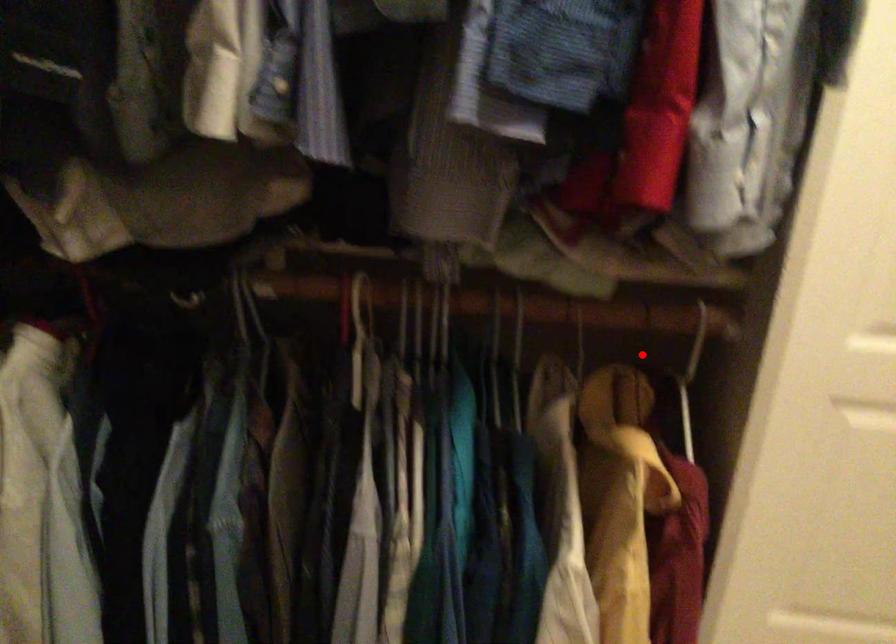
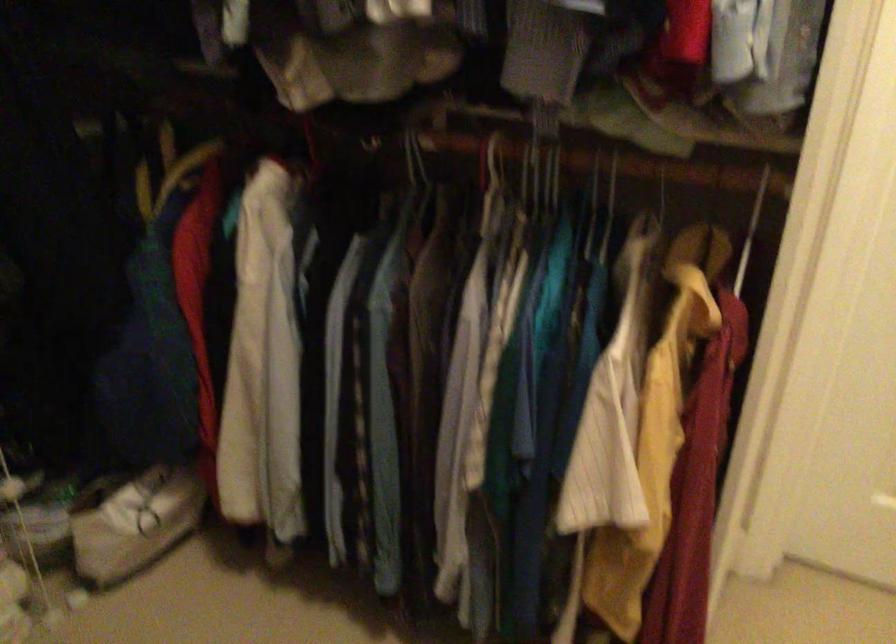
Question: I am providing you with two images of the same scene from different viewpoints. A red point is shown in image1. For the corresponding object point in image2, is it positioned nearer or farther from the camera?

Choices:
 (A) Nearer
 (B) Farther

Answer: (B)